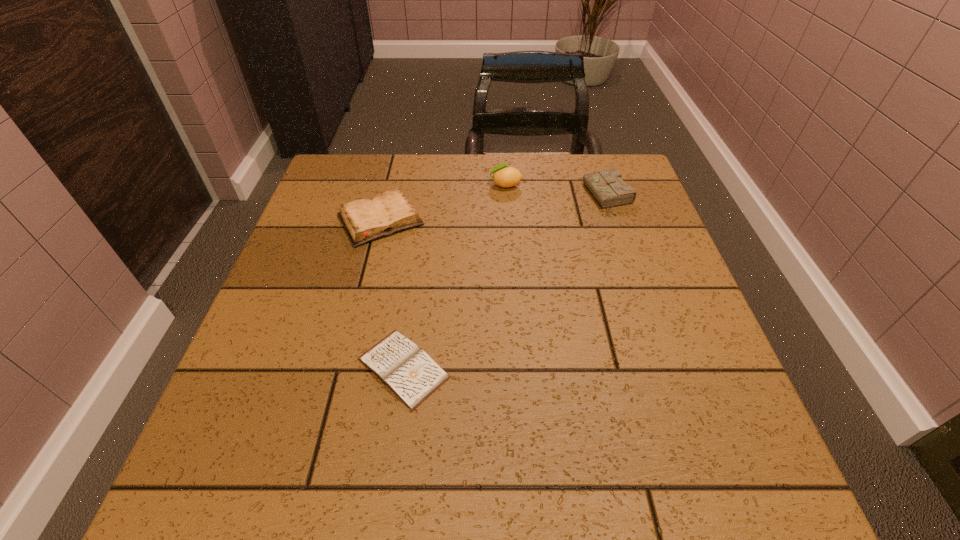
You are a GUI agent. You are given a task and a screenshot of the screen. Output one action in this format:
    pyautogui.click(x=<x>, y=<y>)
    Task: Click on the vacant area at the far left corner of the desktop
    
    Given the screenshot: What is the action you would take?
    point(351,163)

In order to click on vacant space at the near left corner of the desktop in this screenshot , I will do `click(248, 473)`.

In the image, there is a desktop. Find the location of `blank space at the far right corner`. blank space at the far right corner is located at coordinates (618, 168).

I want to click on vacant region at the near right corner of the desktop, so click(740, 482).

I want to click on free space between the second shortest object and the tallest object, so click(x=443, y=202).

In order to click on vacant space that's between the shortest diary and the rightmost diary in this screenshot , I will do `click(506, 282)`.

Locate an element on the screen. free space between the rightmost object and the tallest object is located at coordinates (557, 191).

Identify the location of empty space that is in between the rightmost object and the lemon. The width and height of the screenshot is (960, 540). (557, 191).

The height and width of the screenshot is (540, 960). Find the location of `free spot between the rightmost object and the lemon`. free spot between the rightmost object and the lemon is located at coordinates (557, 191).

In order to click on vacant area that lies between the second tallest diary and the rightmost diary in this screenshot , I will do `click(494, 208)`.